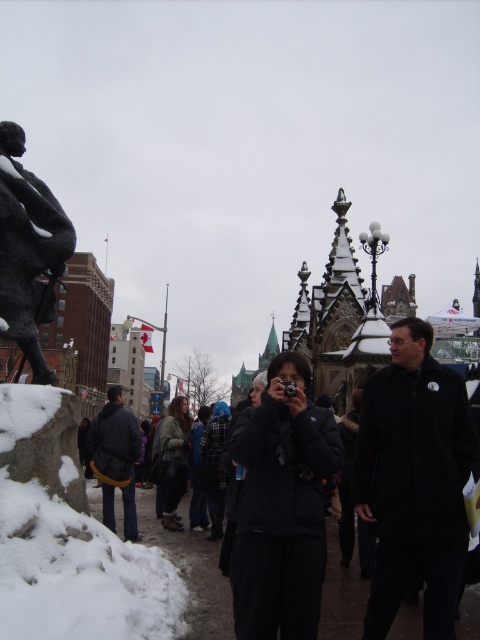
Question: Which object is closer to the camera taking this photo?

Choices:
 (A) black fabric jacket at center
 (B) black matte jacket at center
 (C) dark gray jacket at center
 (D) black matte coat at center

Answer: (B)

Question: Which of the following is the farthest from the observer?

Choices:
 (A) pos(116,458)
 (B) pos(32,189)
 (C) pos(342,612)
 (D) pos(387,392)

Answer: (A)

Question: Is black matte jacket at center to the left of black fabric jacket at center from the viewer's perspective?

Choices:
 (A) no
 (B) yes

Answer: (A)

Question: Which point is closer to the camera taking this photo?

Choices:
 (A) (467, 620)
 (B) (60, 230)
 (C) (106, 438)
 (D) (278, 554)

Answer: (D)

Question: Is black matte coat at center in front of black matte jacket at center?

Choices:
 (A) yes
 (B) no

Answer: (B)

Question: Can you confirm if bronze statue at left is positioned to the right of dark gray jacket at center?

Choices:
 (A) yes
 (B) no

Answer: (B)